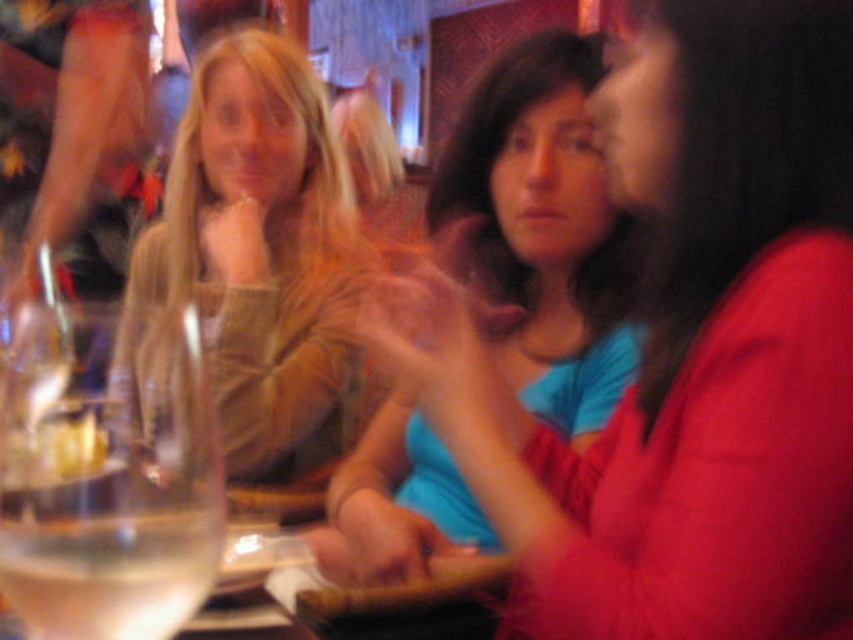
Does matte blue shirt at center have a larger size compared to clear glass wine glass at left?

Indeed, matte blue shirt at center has a larger size compared to clear glass wine glass at left.

The width and height of the screenshot is (853, 640). Find the location of `matte blue shirt at center`. matte blue shirt at center is located at coordinates (685, 352).

The width and height of the screenshot is (853, 640). What do you see at coordinates (685, 352) in the screenshot?
I see `matte blue shirt at center` at bounding box center [685, 352].

You are a GUI agent. You are given a task and a screenshot of the screen. Output one action in this format:
    pyautogui.click(x=<x>, y=<y>)
    Task: Click on the matte blue shirt at center
    The width and height of the screenshot is (853, 640).
    Given the screenshot: What is the action you would take?
    pyautogui.click(x=685, y=352)

Can you confirm if matte blue shirt at center is bigger than clear glass at lower left?

Correct, matte blue shirt at center is larger in size than clear glass at lower left.

Is matte blue shirt at center closer to camera compared to clear glass at lower left?

No, it is behind clear glass at lower left.

Describe the element at coordinates (685, 352) in the screenshot. I see `matte blue shirt at center` at that location.

In order to click on matte blue shirt at center in this screenshot , I will do `click(685, 352)`.

Can you confirm if matte blue shirt at center is positioned to the right of matte brown sweater at center?

Indeed, matte blue shirt at center is positioned on the right side of matte brown sweater at center.

Does matte blue shirt at center have a lesser width compared to matte brown sweater at center?

Correct, matte blue shirt at center's width is less than matte brown sweater at center's.

Is point (792, 566) positioned in front of point (224, 157)?

Yes, point (792, 566) is closer to viewer.

This screenshot has height=640, width=853. Identify the location of matte blue shirt at center. click(x=685, y=352).